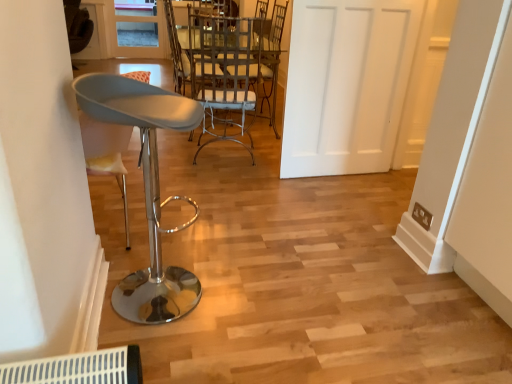
Question: In terms of size, does matte gray stool at left, marked as the 2th chair in a back-to-front arrangement, appear bigger or smaller than white matte door at center?

Choices:
 (A) small
 (B) big

Answer: (A)

Question: In the image, is matte gray stool at left, marked as the 2th chair in a back-to-front arrangement, on the left side or the right side of white matte door at center?

Choices:
 (A) left
 (B) right

Answer: (A)

Question: Based on their relative distances, which object is farther from the white fabric chair at center, which is the 1th chair in back-to-front order?

Choices:
 (A) clear glass door at upper center
 (B) white matte door at center
 (C) matte gray stool at left, marked as the 2th chair in a back-to-front arrangement

Answer: (C)

Question: Which of these objects is positioned closest to the white matte door at center?

Choices:
 (A) matte gray stool at left, marked as the 2th chair in a back-to-front arrangement
 (B) white fabric chair at center, which is the 1th chair in back-to-front order
 (C) clear glass door at upper center

Answer: (B)